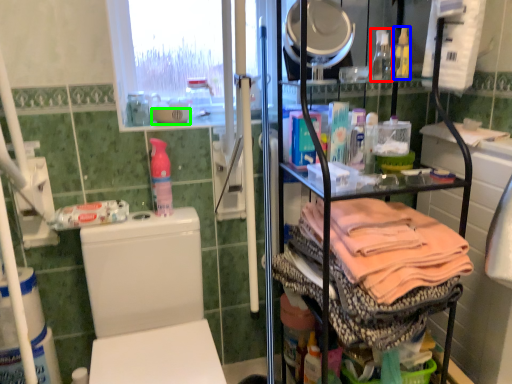
Question: Which object is the closest to the bottle (highlighted by a red box)? Choose among these: bottle (highlighted by a blue box) or bowl (highlighted by a green box).

Choices:
 (A) bottle
 (B) bowl

Answer: (A)